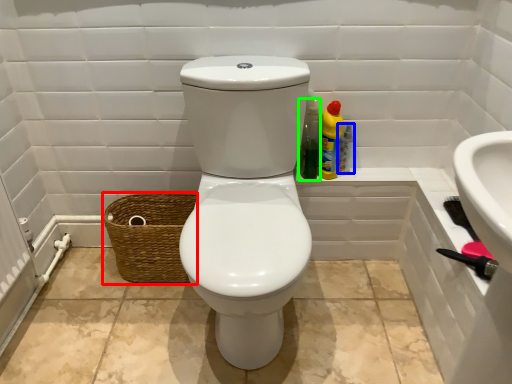
Question: Which is nearer to the basket (highlighted by a red box)? bottle (highlighted by a blue box) or cleaning product (highlighted by a green box).

Choices:
 (A) bottle
 (B) cleaning product

Answer: (B)